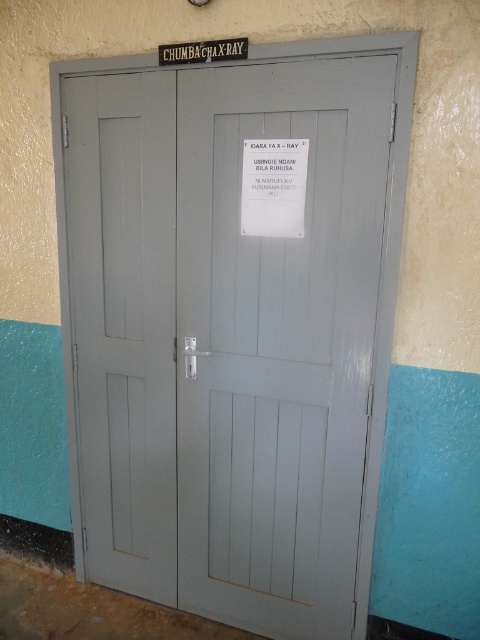
You are standing in front of the double doors with a gray color and a black sign above them. There are two points marked on the doors. The first point is at coordinates point [276,166] and the second is at point [180,61]. Which point is closer to you as you face the doors?

Point [276,166] is closer to you because it is in front of point [180,61].

Based on the photo, you are a patient entering a hospital and see the matte gray door at center and the white paper at center. Which object is positioned lower?

The matte gray door at center is located below the white paper at center, so it is positioned lower.